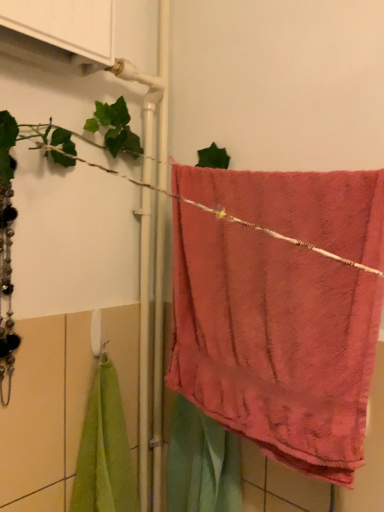
This screenshot has width=384, height=512. What do you see at coordinates (274, 342) in the screenshot? I see `coral plush towel at center` at bounding box center [274, 342].

Locate an element on the screen. This screenshot has width=384, height=512. coral plush towel at center is located at coordinates (274, 342).

What is the approximate height of coral plush towel at center?

21.20 inches.

Describe the element at coordinates (97, 334) in the screenshot. The image size is (384, 512). I see `white plastic towel bar at center` at that location.

You are a GUI agent. You are given a task and a screenshot of the screen. Output one action in this format:
    pyautogui.click(x=<x>, y=<y>)
    Task: Click on the white plastic towel bar at center
    The width and height of the screenshot is (384, 512).
    Given the screenshot: What is the action you would take?
    pyautogui.click(x=97, y=334)

Identify the location of coral plush towel at center. (274, 342).

Which is more to the left, white plastic towel bar at center or coral plush towel at center?

white plastic towel bar at center is more to the left.

Which object is closer to the camera taking this photo, white plastic towel bar at center or coral plush towel at center?

coral plush towel at center is closer to the camera.

Is point (100, 350) behind point (283, 218)?

Yes.

From the image's perspective, is white plastic towel bar at center located beneath coral plush towel at center?

Correct, white plastic towel bar at center appears lower than coral plush towel at center in the image.

From a real-world perspective, between white plastic towel bar at center and coral plush towel at center, who is vertically higher?

coral plush towel at center, from a real-world perspective.

Which of these two, white plastic towel bar at center or coral plush towel at center, is thinner?

white plastic towel bar at center is thinner.

Can you confirm if white plastic towel bar at center is shorter than coral plush towel at center?

Correct, white plastic towel bar at center is not as tall as coral plush towel at center.

Can you confirm if white plastic towel bar at center is smaller than coral plush towel at center?

Yes.

Is white plastic towel bar at center completely or partially outside of coral plush towel at center?

white plastic towel bar at center is positioned outside coral plush towel at center.

Does white plastic towel bar at center touch coral plush towel at center?

white plastic towel bar at center and coral plush towel at center are clearly separated.

From the picture: Is white plastic towel bar at center aimed at coral plush towel at center?

Yes, white plastic towel bar at center is aimed at coral plush towel at center.

Measure the distance between white plastic towel bar at center and coral plush towel at center.

white plastic towel bar at center is 15.86 inches away from coral plush towel at center.

Locate an element on the screen. This screenshot has width=384, height=512. towel bar that appears behind the coral plush towel at center is located at coordinates (97, 334).

Between coral plush towel at center and white plastic towel bar at center, which one appears on the right side from the viewer's perspective?

From the viewer's perspective, coral plush towel at center appears more on the right side.

Which object is more forward, coral plush towel at center or white plastic towel bar at center?

coral plush towel at center is more forward.

Is point (312, 172) positioned before point (99, 317)?

Yes.

From the image's perspective, which is below, coral plush towel at center or white plastic towel bar at center?

From the image's view, white plastic towel bar at center is below.

From a real-world perspective, which object rests below the other?

In real-world perspective, white plastic towel bar at center is lower.

Which object is thinner, coral plush towel at center or white plastic towel bar at center?

Thinner between the two is white plastic towel bar at center.

Is coral plush towel at center shorter than white plastic towel bar at center?

No.

In terms of size, does coral plush towel at center appear bigger or smaller than white plastic towel bar at center?

Clearly, coral plush towel at center is larger in size than white plastic towel bar at center.

Would you say coral plush towel at center is inside or outside white plastic towel bar at center?

coral plush towel at center is not enclosed by white plastic towel bar at center.

Would you consider coral plush towel at center to be distant from white plastic towel bar at center?

No, there isn't a large distance between coral plush towel at center and white plastic towel bar at center.

Is coral plush towel at center looking in the opposite direction of white plastic towel bar at center?

That's not correct — coral plush towel at center is not looking away from white plastic towel bar at center.

How different are the orientations of coral plush towel at center and white plastic towel bar at center in degrees?

The facing directions of coral plush towel at center and white plastic towel bar at center are 90 degrees apart.

Measure the distance between coral plush towel at center and white plastic towel bar at center.

coral plush towel at center is 15.86 inches away from white plastic towel bar at center.

At what (x,y) coordinates should I click in order to perform the action: click on towel bar behind the coral plush towel at center. Please return your answer as a coordinate pair (x, y). This screenshot has height=512, width=384. Looking at the image, I should click on (97, 334).

Find the location of a particular element. This screenshot has height=512, width=384. towel bar that is behind the coral plush towel at center is located at coordinates (97, 334).

This screenshot has height=512, width=384. Identify the location of towel above the white plastic towel bar at center (from a real-world perspective). (274, 342).